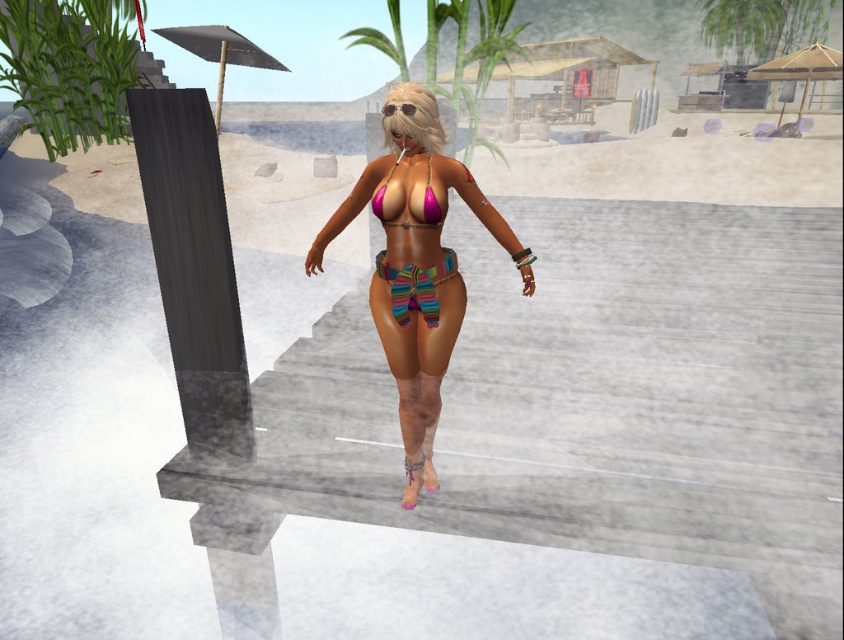
You are a photographer trying to capture the pink matte bikini top at center without any obstructions. Given that the dark gray textured pillar at left is in the background, will the pillar block your view of the bikini top?

The dark gray textured pillar at left is bigger than the pink matte bikini top at center, so it might block the view depending on their positions. However, since the pillar is at the left and the bikini top is at the center, the pillar may not fully obstruct the bikini top unless they are aligned in a way that the pillar is directly between the camera and the bikini top. Without specific positioning details, it is uncertain, but generally, being at the left and center might allow partial visibility.

You are standing at the beach and want to place a small flag at one of two points. The first point is at coordinates point (207, 116) and the second point is at point (406, 305). Which point is closer to you so that the flag can be easily seen from where you are standing?

Point (207, 116) is closer to the viewer than point (406, 305), so placing the flag there would make it more visible from your current position.

You are standing at the beach and want to place a 6.5 feet long surfboard between you and the dark gray textured pillar at left. Can you fit it there?

The dark gray textured pillar at left is 6.52 feet from viewer. Since the surfboard is 6.5 feet long, it can be placed between you and the pillar as the distance is slightly longer than the surfboard.